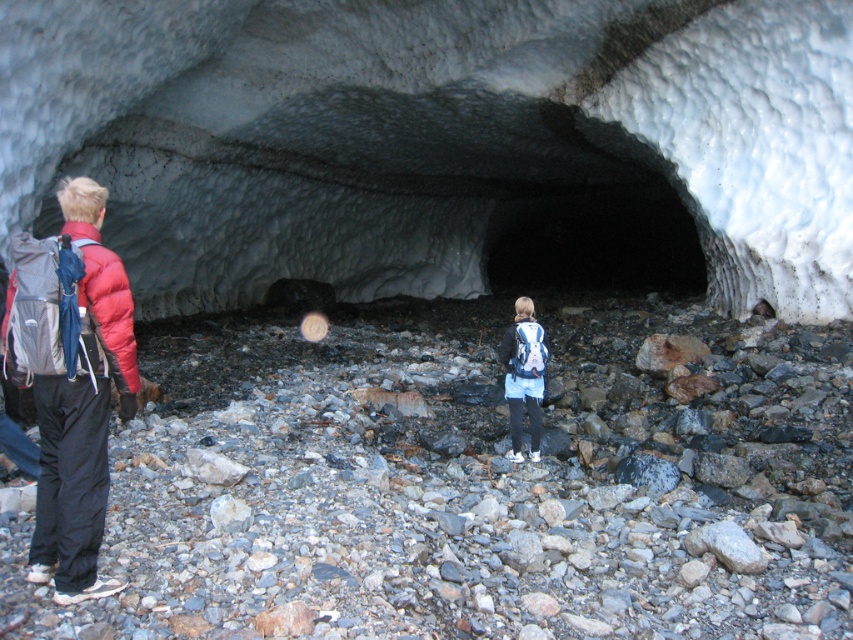
In the scene shown: Who is taller, smooth gray rock at center or matte blue backpack at center?

smooth gray rock at center

Is smooth gray rock at center above matte blue backpack at center?

Yes.

Does point (399, 620) come in front of point (519, 328)?

Yes, it is in front of point (519, 328).

What are the coordinates of `smooth gray rock at center` in the screenshot? It's located at (466, 484).

Does white frosty ice cave at center appear on the right side of matte blue backpack at center?

Correct, you'll find white frosty ice cave at center to the right of matte blue backpack at center.

Is white frosty ice cave at center thinner than matte blue backpack at center?

No.

This screenshot has width=853, height=640. I want to click on white frosty ice cave at center, so click(x=442, y=145).

Between white frosty ice cave at center and smooth gray rock at center, which one appears on the left side from the viewer's perspective?

Positioned to the left is smooth gray rock at center.

Is white frosty ice cave at center thinner than smooth gray rock at center?

No, white frosty ice cave at center is not thinner than smooth gray rock at center.

Measure the distance between white frosty ice cave at center and camera.

A distance of 19.24 feet exists between white frosty ice cave at center and camera.

Identify the location of white frosty ice cave at center. The height and width of the screenshot is (640, 853). (442, 145).